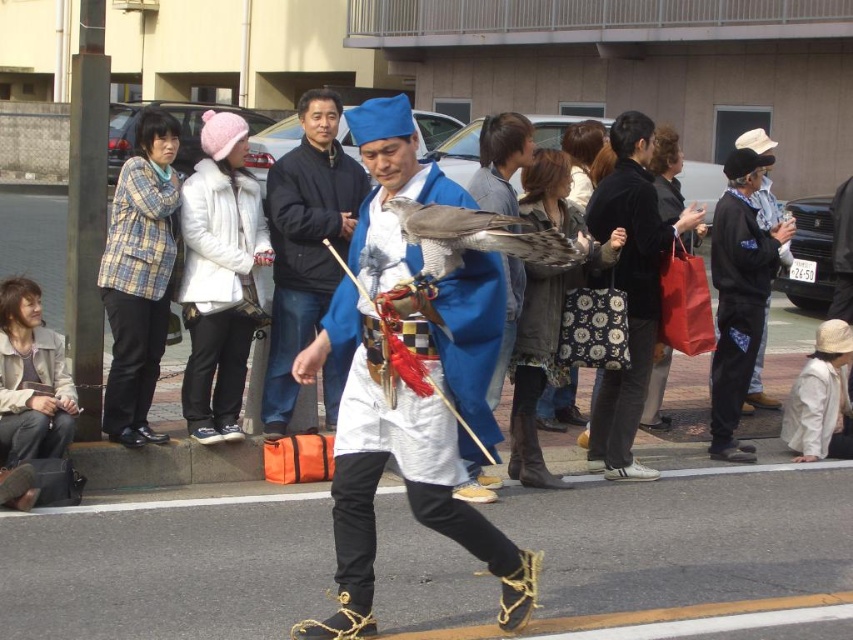
How far apart are black fabric bag at center and leather jacket at lower left?

black fabric bag at center and leather jacket at lower left are 3.44 meters apart.

Between point (618, 218) and point (45, 348), which one is positioned in front?

Positioned in front is point (45, 348).

At what (x,y) coordinates should I click in order to perform the action: click on black fabric bag at center. Please return your answer as a coordinate pair (x, y). The height and width of the screenshot is (640, 853). Looking at the image, I should click on (630, 289).

Based on the photo, which is below, blue silk kimono at center or black fleece jacket at right?

blue silk kimono at center is lower down.

The height and width of the screenshot is (640, 853). Describe the element at coordinates (395, 394) in the screenshot. I see `blue silk kimono at center` at that location.

This screenshot has width=853, height=640. What are the coordinates of `blue silk kimono at center` in the screenshot? It's located at (395, 394).

Does plaid fabric jacket at left appear on the left side of leather jacket at lower left?

No, plaid fabric jacket at left is not to the left of leather jacket at lower left.

Is plaid fabric jacket at left below leather jacket at lower left?

Actually, plaid fabric jacket at left is above leather jacket at lower left.

The image size is (853, 640). What do you see at coordinates (137, 289) in the screenshot? I see `plaid fabric jacket at left` at bounding box center [137, 289].

Image resolution: width=853 pixels, height=640 pixels. What are the coordinates of `plaid fabric jacket at left` in the screenshot? It's located at point(137,289).